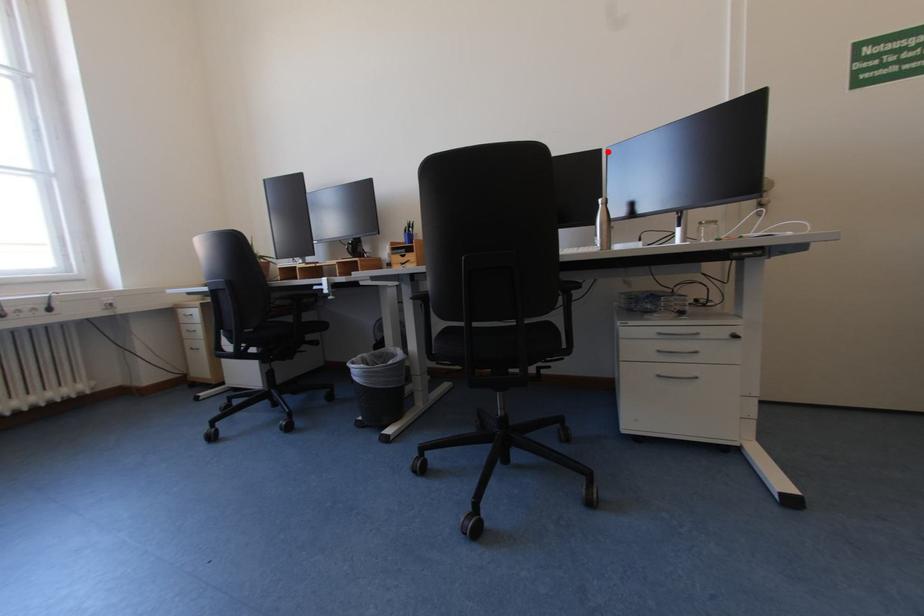
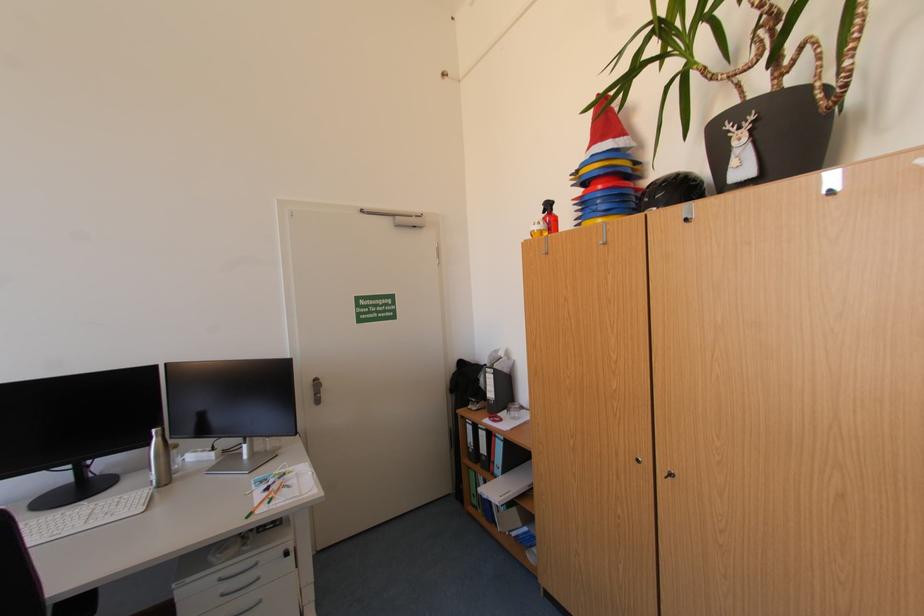
Where in the second image is the point corresponding to the highlighted location from the first image?

(164, 368)